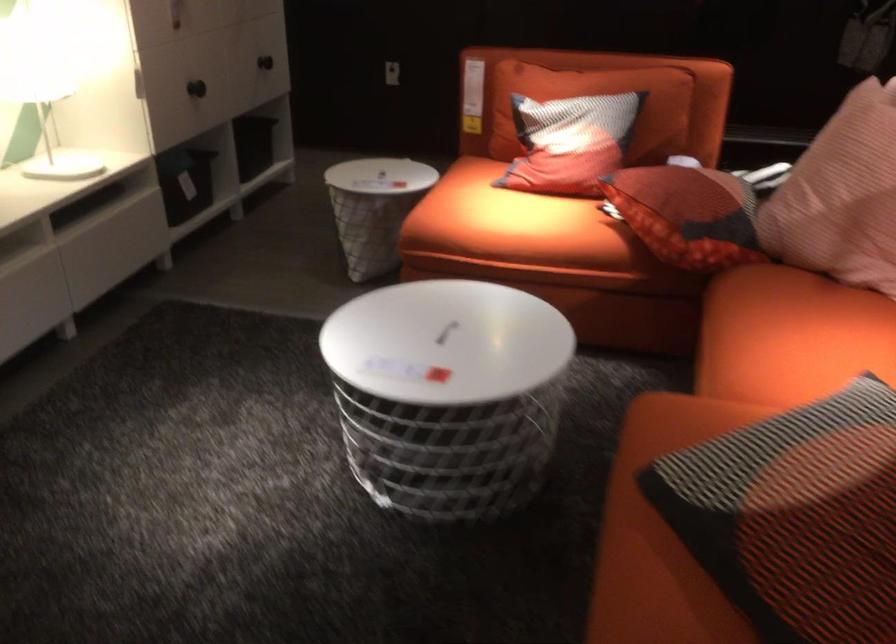
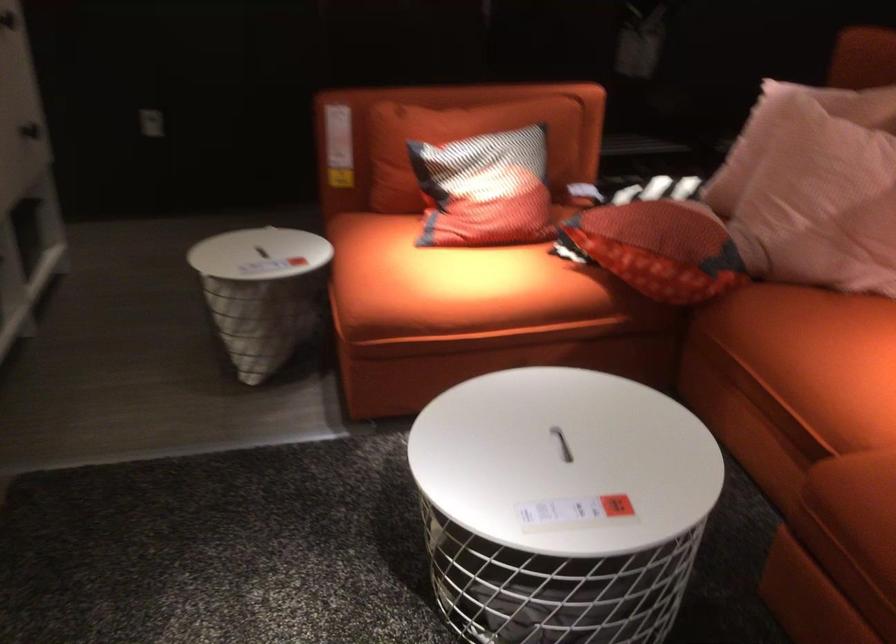
Where in the second image is the point corresponding to [662,210] from the first image?

(659, 248)